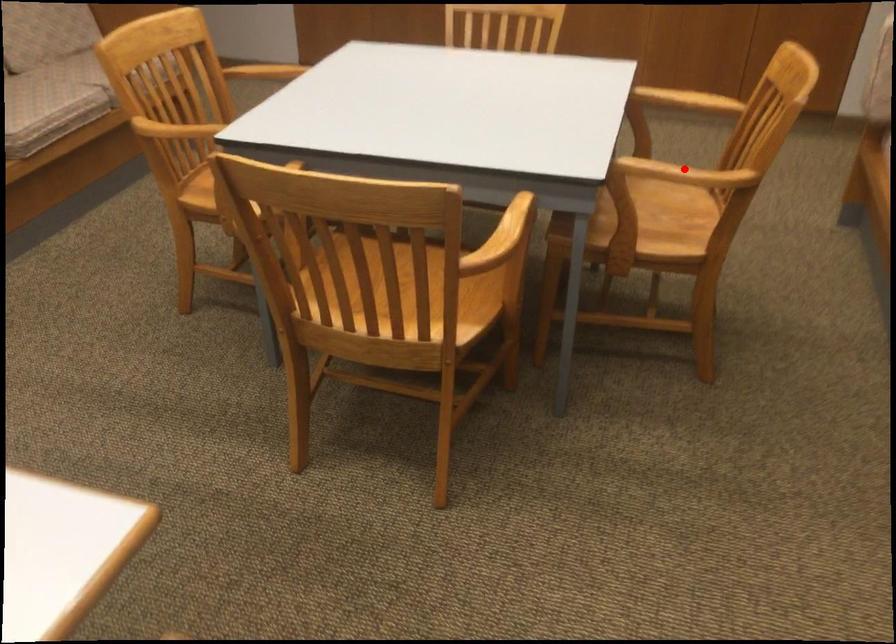
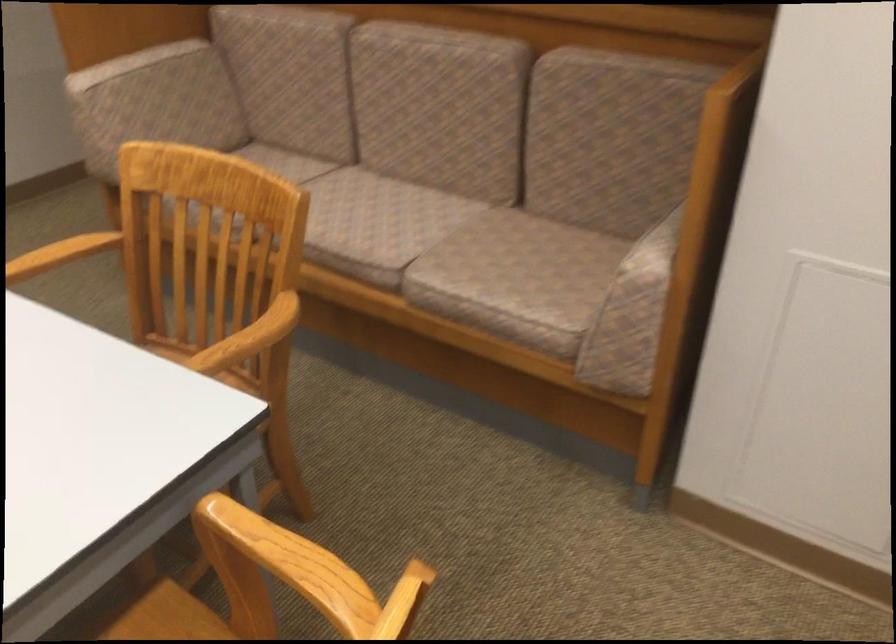
The point at the highlighted location is marked in the first image. Where is the corresponding point in the second image?

(248, 339)